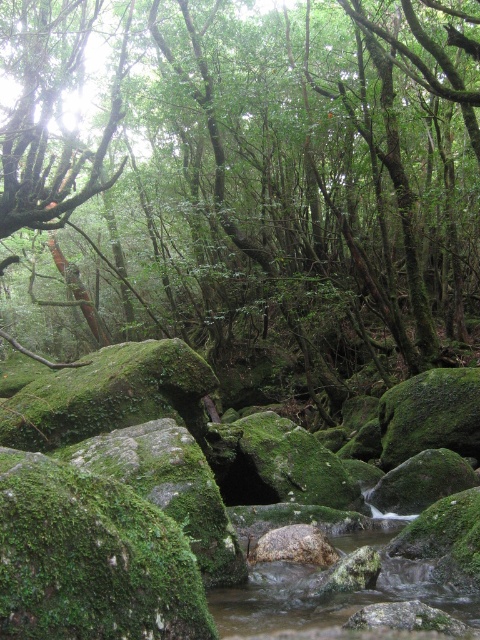
Does point (169, 300) come farther from viewer compared to point (247, 618)?

Yes, point (169, 300) is behind point (247, 618).

Which of these two, green mossy rock at center or clear water at stream center, stands taller?

Standing taller between the two is green mossy rock at center.

At what (x,y) coordinates should I click in order to perform the action: click on green mossy rock at center. Please return your answer as a coordinate pair (x, y). This screenshot has width=480, height=640. Looking at the image, I should click on (252, 186).